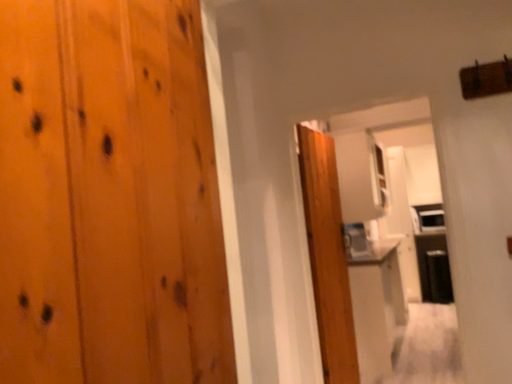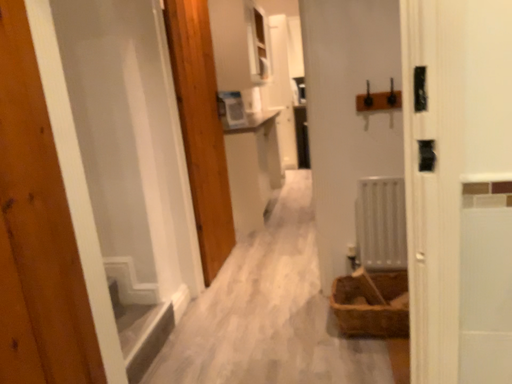
Question: Which way did the camera rotate in the video?

Choices:
 (A) rotated left
 (B) rotated right

Answer: (B)